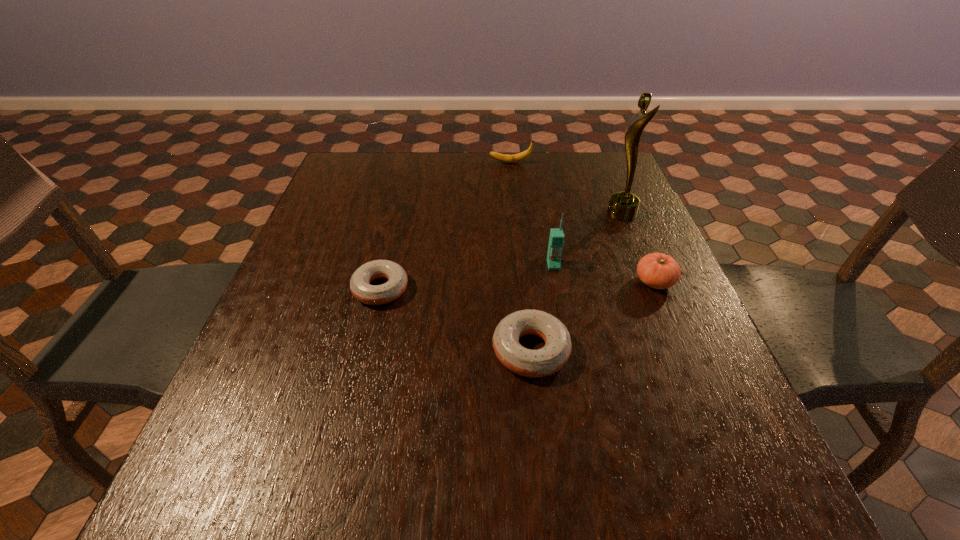
Locate an element on the screen. Image resolution: width=960 pixels, height=540 pixels. free location that satisfies the following two spatial constraints: 1. on the peel of the banana from the top; 2. on the left side of the tomato is located at coordinates (522, 281).

Identify the location of free region that satisfies the following two spatial constraints: 1. on the front-facing side of the tallest object; 2. on the keypad of the second tallest object. (642, 265).

Image resolution: width=960 pixels, height=540 pixels. I want to click on free location that satisfies the following two spatial constraints: 1. on the peel of the farthest object from the top; 2. on the front side of the shortest object, so click(523, 289).

Where is `free spot that satisfies the following two spatial constraints: 1. on the back side of the nearer doughnut; 2. on the peel of the banana from the top`? The height and width of the screenshot is (540, 960). free spot that satisfies the following two spatial constraints: 1. on the back side of the nearer doughnut; 2. on the peel of the banana from the top is located at coordinates (512, 163).

Locate an element on the screen. vacant space that satisfies the following two spatial constraints: 1. on the back side of the nearer doughnut; 2. on the peel of the banana from the top is located at coordinates (512, 163).